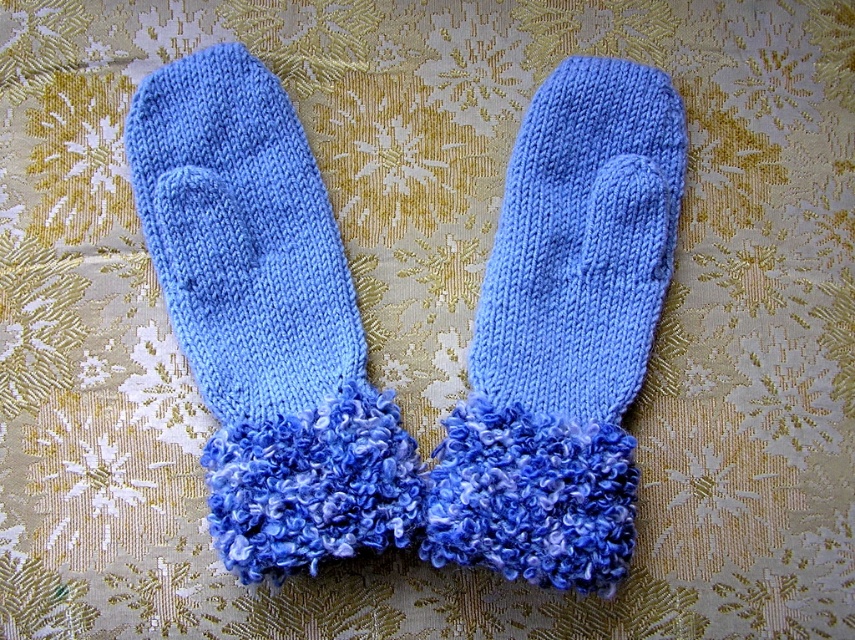
You are organizing a winter clothing display and need to arrange items from tallest to shortest. You have a blue knitted sock at left and blue knitted mittens at center. Which should come first in the display?

The blue knitted sock at left should come first in the display since it has a greater height compared to the blue knitted mittens at center.

You are looking at the image of the mittens. There are two points marked on them. The first point is at coordinate point (223, 518) and the second is at point (556, 232). Which point is closer to you?

Point (223, 518) is closer to the camera than point (556, 232).